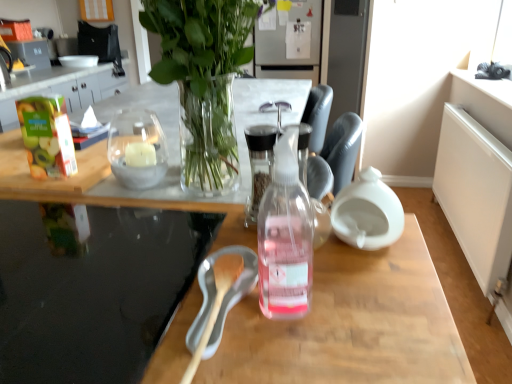
Question: From the image's perspective, is transparent glass table at lower left below clear glass candle at center?

Choices:
 (A) yes
 (B) no

Answer: (A)

Question: Is transparent glass table at lower left further to camera compared to clear glass candle at center?

Choices:
 (A) no
 (B) yes

Answer: (A)

Question: Can you confirm if transparent glass table at lower left is bigger than clear glass candle at center?

Choices:
 (A) yes
 (B) no

Answer: (A)

Question: Considering the relative positions of transparent glass table at lower left and clear glass candle at center in the image provided, is transparent glass table at lower left in front of clear glass candle at center?

Choices:
 (A) no
 (B) yes

Answer: (B)

Question: Is transparent glass table at lower left not within clear glass candle at center?

Choices:
 (A) yes
 (B) no

Answer: (A)

Question: Is transparent glass table at lower left positioned with its back to clear glass candle at center?

Choices:
 (A) no
 (B) yes

Answer: (A)

Question: Is clear glass candle at center wider than clear glass vase at upper center?

Choices:
 (A) no
 (B) yes

Answer: (A)

Question: From the image's perspective, does clear glass candle at center appear higher than clear glass vase at upper center?

Choices:
 (A) no
 (B) yes

Answer: (A)

Question: From a real-world perspective, is clear glass candle at center physically above clear glass vase at upper center?

Choices:
 (A) no
 (B) yes

Answer: (A)

Question: Is clear glass candle at center positioned far away from clear glass vase at upper center?

Choices:
 (A) no
 (B) yes

Answer: (A)

Question: From a real-world perspective, is clear glass candle at center beneath clear glass vase at upper center?

Choices:
 (A) no
 (B) yes

Answer: (B)

Question: Is the position of clear glass candle at center more distant than that of clear glass vase at upper center?

Choices:
 (A) yes
 (B) no

Answer: (A)

Question: Does clear glass candle at center turn towards transparent glass table at lower left?

Choices:
 (A) no
 (B) yes

Answer: (A)